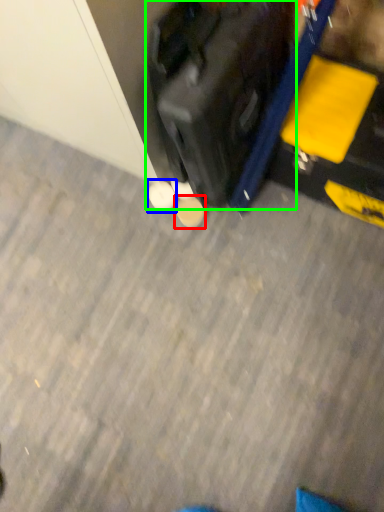
Question: Which object is positioned closest to footwear (highlighted by a red box)? Select from footwear (highlighted by a blue box) and suitcase (highlighted by a green box).

Choices:
 (A) footwear
 (B) suitcase

Answer: (A)